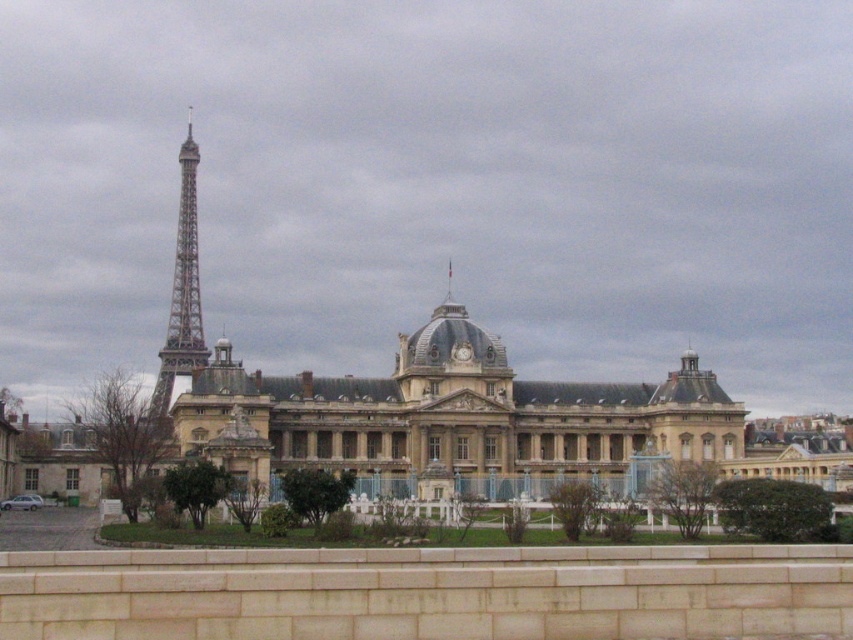
Does brown stone building at center appear on the left side of painted steel eiffel tower at left?

Incorrect, brown stone building at center is not on the left side of painted steel eiffel tower at left.

This screenshot has height=640, width=853. What do you see at coordinates (451, 419) in the screenshot? I see `brown stone building at center` at bounding box center [451, 419].

Who is more distant from viewer, (589,428) or (189,200)?

Positioned behind is point (189,200).

Locate an element on the screen. This screenshot has width=853, height=640. brown stone building at center is located at coordinates (451, 419).